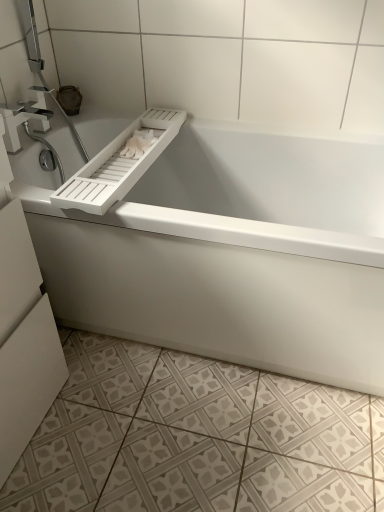
Locate an element on the screen. free point above white textured tile at lower center (from a real-world perspective) is located at coordinates (172, 428).